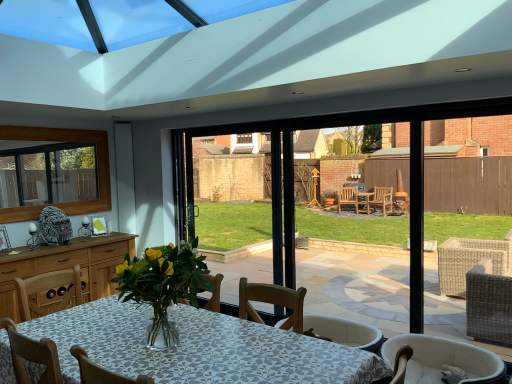
You are a GUI agent. You are given a task and a screenshot of the screen. Output one action in this format:
    pyautogui.click(x=<x>, y=<y>)
    Task: Click on the white fabric chair at lower right
    This screenshot has width=512, height=384.
    Given the screenshot: What is the action you would take?
    pyautogui.click(x=444, y=359)

This screenshot has width=512, height=384. What do you see at coordinates (444, 359) in the screenshot?
I see `white fabric chair at lower right` at bounding box center [444, 359].

At what (x,y) coordinates should I click in order to perform the action: click on wooden frame at upper left. Please return your answer as a coordinate pair (x, y). Looking at the image, I should click on (72, 141).

Measure the distance between point (14, 138) and camera.

Point (14, 138) is 4.89 meters away from camera.

Describe the element at coordinates (72, 141) in the screenshot. I see `wooden frame at upper left` at that location.

Where is `white fabric chair at lower right`? This screenshot has width=512, height=384. white fabric chair at lower right is located at coordinates pyautogui.click(x=444, y=359).

Considering the positions of objects white fabric chair at lower right and wooden frame at upper left in the image provided, who is more to the right, white fabric chair at lower right or wooden frame at upper left?

Positioned to the right is white fabric chair at lower right.

Is white fabric chair at lower right positioned in front of wooden frame at upper left?

Yes, it is.

Does point (488, 382) come behind point (25, 128)?

No, (488, 382) is closer to viewer.

From the image's perspective, which is below, white fabric chair at lower right or wooden frame at upper left?

white fabric chair at lower right appears lower in the image.

From a real-world perspective, which object rests below the other?

white fabric chair at lower right.

Which object is thinner, white fabric chair at lower right or wooden frame at upper left?

Thinner between the two is wooden frame at upper left.

Considering the sizes of objects white fabric chair at lower right and wooden frame at upper left in the image provided, who is shorter, white fabric chair at lower right or wooden frame at upper left?

white fabric chair at lower right.

Which of these two, white fabric chair at lower right or wooden frame at upper left, is smaller?

Smaller between the two is wooden frame at upper left.

Is wooden frame at upper left inside white fabric chair at lower right?

No.

Is there a large distance between white fabric chair at lower right and wooden frame at upper left?

Indeed, white fabric chair at lower right is not near wooden frame at upper left.

Is white fabric chair at lower right looking in the opposite direction of wooden frame at upper left?

No.

Measure the distance from white fabric chair at lower right to wooden frame at upper left.

white fabric chair at lower right and wooden frame at upper left are 14.18 feet apart.

You are a GUI agent. You are given a task and a screenshot of the screen. Output one action in this format:
    pyautogui.click(x=<x>, y=<y>)
    Task: Click on the chair in front of the wooden frame at upper left
    
    Given the screenshot: What is the action you would take?
    pyautogui.click(x=444, y=359)

In the image, is wooden frame at upper left on the left side or the right side of white fabric chair at lower right?

wooden frame at upper left is to the left of white fabric chair at lower right.

Does wooden frame at upper left lie behind white fabric chair at lower right?

Yes.

Between point (97, 157) and point (445, 352), which one is positioned behind?

The point (97, 157) is farther.

From the image's perspective, relative to white fabric chair at lower right, is wooden frame at upper left above or below?

Clearly, from the image's perspective, wooden frame at upper left is above white fabric chair at lower right.

From a real-world perspective, is wooden frame at upper left physically located above or below white fabric chair at lower right?

Clearly, from a real-world perspective, wooden frame at upper left is above white fabric chair at lower right.

From the picture: Looking at their sizes, would you say wooden frame at upper left is wider or thinner than white fabric chair at lower right?

wooden frame at upper left is thinner than white fabric chair at lower right.

Does wooden frame at upper left have a greater height compared to white fabric chair at lower right?

Indeed, wooden frame at upper left has a greater height compared to white fabric chair at lower right.

Is wooden frame at upper left bigger or smaller than white fabric chair at lower right?

wooden frame at upper left is smaller than white fabric chair at lower right.

Would you say white fabric chair at lower right is part of wooden frame at upper left's contents?

No, white fabric chair at lower right is not a part of wooden frame at upper left.

Would you consider wooden frame at upper left to be distant from white fabric chair at lower right?

Absolutely, wooden frame at upper left is distant from white fabric chair at lower right.

Based on the photo, could you tell me if wooden frame at upper left is turned towards white fabric chair at lower right?

Yes, wooden frame at upper left is turned towards white fabric chair at lower right.

How different are the orientations of wooden frame at upper left and white fabric chair at lower right in degrees?

93.6 degrees separate the facing orientations of wooden frame at upper left and white fabric chair at lower right.

The height and width of the screenshot is (384, 512). I want to click on chair in front of the wooden frame at upper left, so click(444, 359).

This screenshot has width=512, height=384. Identify the location of chair that is in front of the wooden frame at upper left. click(x=444, y=359).

Image resolution: width=512 pixels, height=384 pixels. In order to click on window that appears above the white fabric chair at lower right (from a real-world perspective) in this screenshot , I will do `click(72, 141)`.